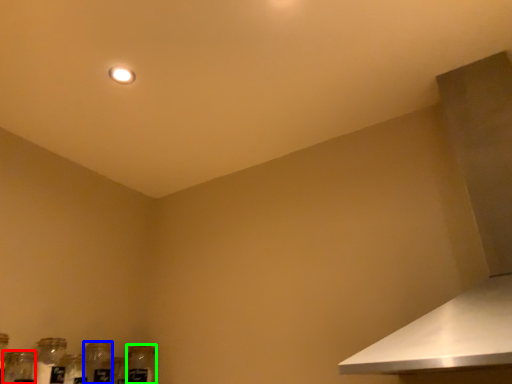
Question: Which is farther away from glass jar (highlighted by a red box)? bottle (highlighted by a blue box) or glass bottle (highlighted by a green box)?

Choices:
 (A) bottle
 (B) glass bottle

Answer: (B)